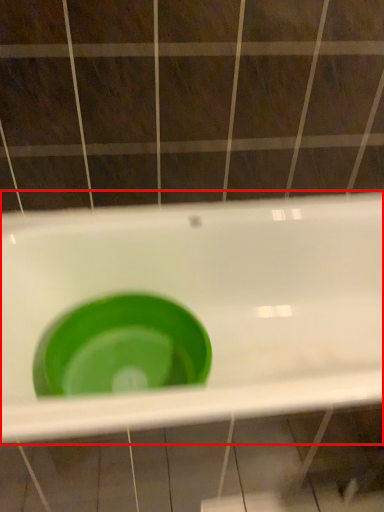
Question: Where is sink (annotated by the red box) located in relation to basin in the image?

Choices:
 (A) right
 (B) left

Answer: (A)